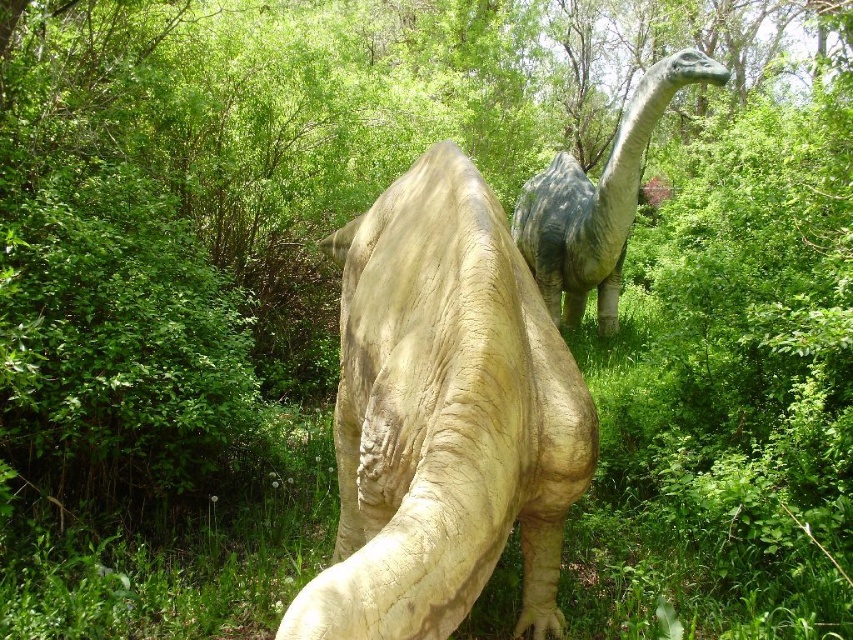
Can you confirm if matte beige dinosaur at center is positioned to the right of shiny gray dinosaur at center?

Incorrect, matte beige dinosaur at center is not on the right side of shiny gray dinosaur at center.

Find the location of a particular element. matte beige dinosaur at center is located at coordinates (444, 417).